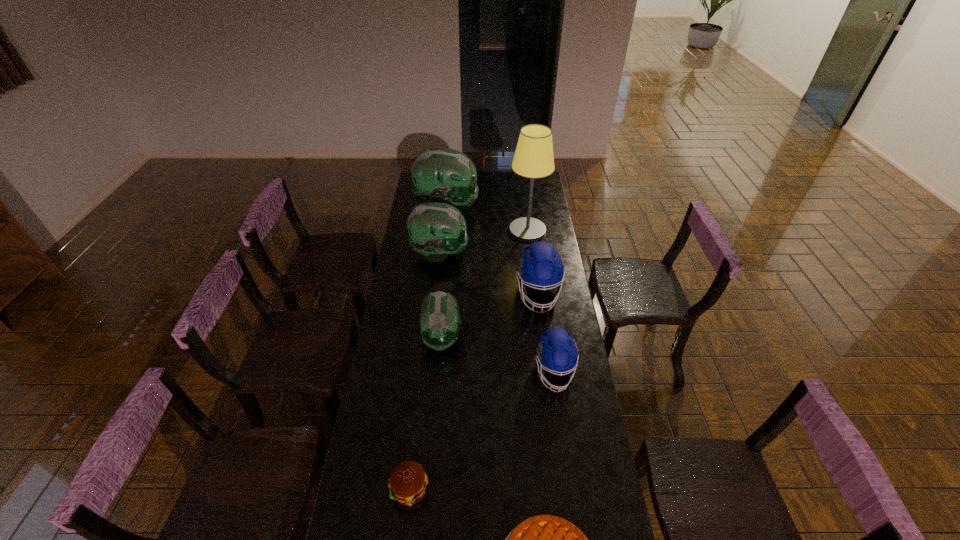
Image resolution: width=960 pixels, height=540 pixels. Find the location of `the seventh farthest object`. the seventh farthest object is located at coordinates (407, 484).

Locate an element on the screen. Image resolution: width=960 pixels, height=540 pixels. free region located on the left of the table lamp is located at coordinates (492, 231).

The image size is (960, 540). What are the coordinates of `free space located 0.170m on the visor of the farthest football helmet` in the screenshot? It's located at (508, 209).

The width and height of the screenshot is (960, 540). I want to click on free space located 0.060m on the visor of the fourth nearest football helmet, so click(x=480, y=254).

The height and width of the screenshot is (540, 960). What are the coordinates of `vacant space located on the face guard of the bigger blue football helmet` in the screenshot? It's located at (543, 332).

Identify the location of vacant area situated on the visor of the nearest green football helmet. The image size is (960, 540). (435, 416).

This screenshot has width=960, height=540. Find the location of `free space located 0.390m on the face guard of the nearer blue football helmet`. free space located 0.390m on the face guard of the nearer blue football helmet is located at coordinates (574, 506).

At what (x,y) coordinates should I click in order to perform the action: click on vacant area located 0.360m on the right of the brown hamburger. Please return your answer as a coordinate pair (x, y). This screenshot has height=540, width=960. Looking at the image, I should click on (541, 489).

Locate an element on the screen. The width and height of the screenshot is (960, 540). hamburger that is at the left edge is located at coordinates (407, 484).

You are a GUI agent. You are given a task and a screenshot of the screen. Output one action in this format:
    pyautogui.click(x=<x>, y=<y>)
    Task: Click on the table lamp that is at the right edge
    This screenshot has height=540, width=960.
    Given the screenshot: What is the action you would take?
    pyautogui.click(x=533, y=158)